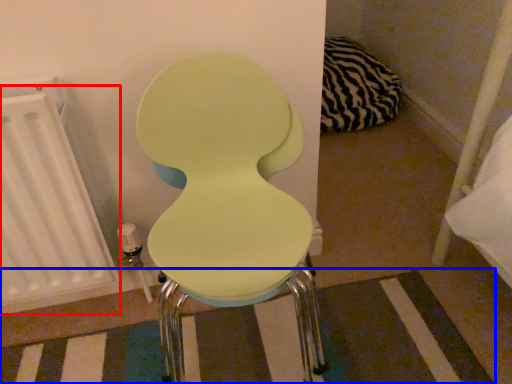
Question: Which object is closer to the camera taking this photo, radiator (highlighted by a red box) or strip (highlighted by a blue box)?

Choices:
 (A) radiator
 (B) strip

Answer: (A)